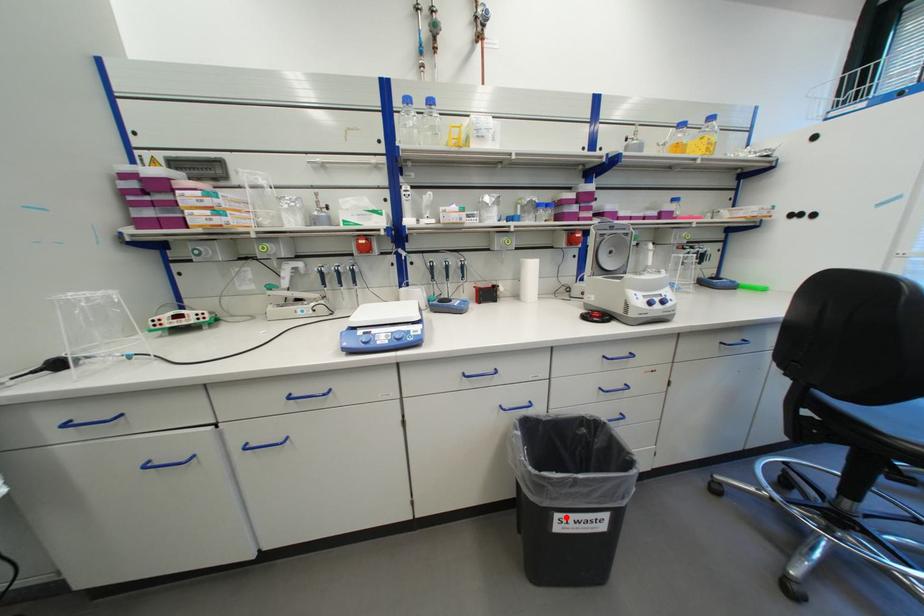
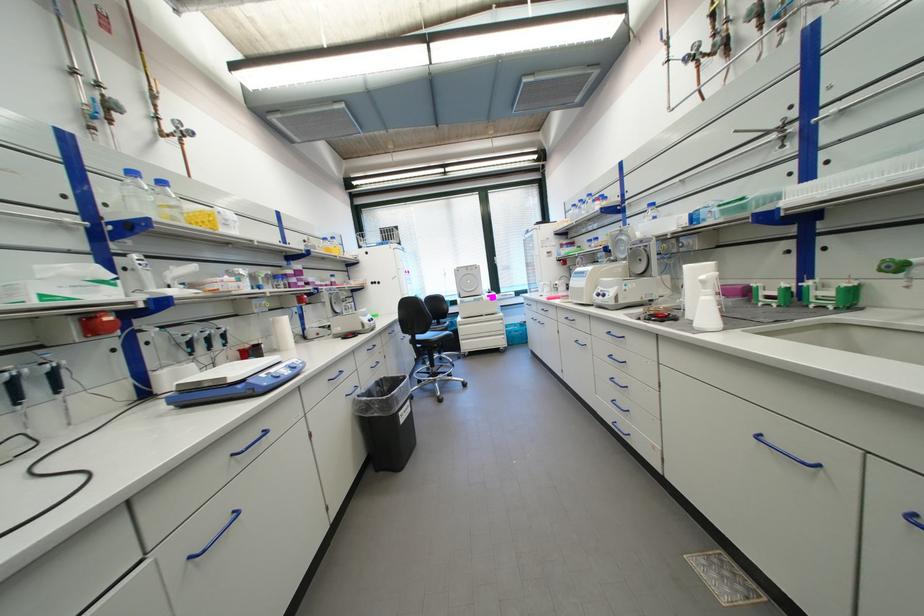
Question: I am providing you with two images of the same scene from different viewpoints. Image1 has a red point marked. In image2, the corresponding 3D location appears at what relative position? Reply with the corresponding letter.

Choices:
 (A) Closer
 (B) Farther

Answer: (A)